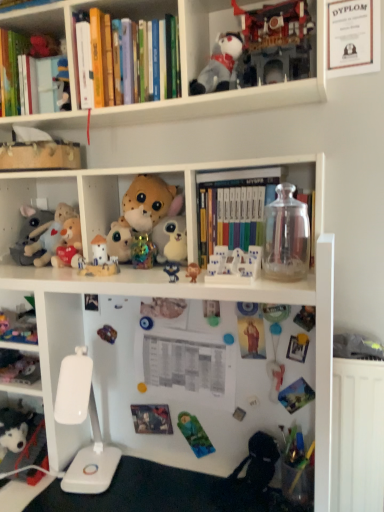
Question: From a real-world perspective, is white plush dog at lower left, positioned as the 15th toy in top-to-bottom order, physically below fluffy plush bear at center, the 3th toy in the top-to-bottom sequence?

Choices:
 (A) yes
 (B) no

Answer: (A)

Question: Is white plush dog at lower left, positioned as the 15th toy in top-to-bottom order, positioned beyond the bounds of fluffy plush bear at center, which ranks as the thirteenth toy in bottom-to-top order?

Choices:
 (A) no
 (B) yes

Answer: (B)

Question: Can you confirm if white plush dog at lower left, positioned as the 15th toy in top-to-bottom order, is bigger than fluffy plush bear at center, the 3th toy in the top-to-bottom sequence?

Choices:
 (A) no
 (B) yes

Answer: (A)

Question: Would you say fluffy plush bear at center, the 3th toy in the top-to-bottom sequence, is part of white plush dog at lower left, arranged as the 1th toy when ordered from the bottom,'s contents?

Choices:
 (A) yes
 (B) no

Answer: (B)

Question: Is white plush dog at lower left, arranged as the 1th toy when ordered from the bottom, positioned behind fluffy plush bear at center, which ranks as the thirteenth toy in bottom-to-top order?

Choices:
 (A) yes
 (B) no

Answer: (B)

Question: In terms of height, does matte green book at upper left, acting as the first book starting from the left, look taller or shorter compared to hardcover books at upper center, acting as the second book starting from the top?

Choices:
 (A) short
 (B) tall

Answer: (B)

Question: Looking at their shapes, would you say matte green book at upper left, the first book positioned from the top, is wider or thinner than hardcover books at upper center, the second book positioned from the left?

Choices:
 (A) thin
 (B) wide

Answer: (B)

Question: Relative to hardcover books at upper center, the second book positioned from the left, is matte green book at upper left, the third book in the right-to-left sequence, in front or behind?

Choices:
 (A) behind
 (B) front

Answer: (A)

Question: Is point (1, 59) closer or farther from the camera than point (76, 78)?

Choices:
 (A) farther
 (B) closer

Answer: (A)

Question: Relative to gray plush toy at upper center, arranged as the 14th toy when ordered from the bottom, is white plush dog at lower left, positioned as the 15th toy in top-to-bottom order, in front or behind?

Choices:
 (A) behind
 (B) front

Answer: (A)

Question: From a real-world perspective, is white plush dog at lower left, arranged as the 1th toy when ordered from the bottom, physically located above or below gray plush toy at upper center, arranged as the 14th toy when ordered from the bottom?

Choices:
 (A) below
 (B) above

Answer: (A)

Question: Do you think white plush dog at lower left, arranged as the 1th toy when ordered from the bottom, is within gray plush toy at upper center, arranged as the 14th toy when ordered from the bottom, or outside of it?

Choices:
 (A) inside
 (B) outside

Answer: (B)

Question: In the image, is white plush dog at lower left, arranged as the 1th toy when ordered from the bottom, on the left side or the right side of gray plush toy at upper center, the second toy viewed from the top?

Choices:
 (A) left
 (B) right

Answer: (A)

Question: In the image, is blue fabric plush at center, which is the sixth toy from bottom to top, positioned in front of or behind brown plush bear at center, the ninth toy from the top?

Choices:
 (A) front
 (B) behind

Answer: (B)

Question: From a real-world perspective, is blue fabric plush at center, the tenth toy positioned from the top, positioned above or below brown plush bear at center, placed as the 7th toy when sorted from bottom to top?

Choices:
 (A) below
 (B) above

Answer: (B)